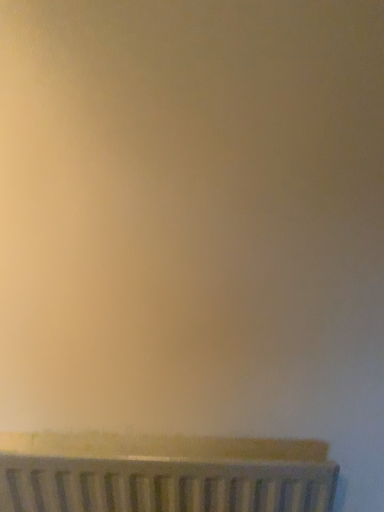
This screenshot has height=512, width=384. Identify the location of white textured radiator at lower center. (163, 474).

The height and width of the screenshot is (512, 384). What do you see at coordinates (163, 474) in the screenshot?
I see `white textured radiator at lower center` at bounding box center [163, 474].

Locate an element on the screen. white textured radiator at lower center is located at coordinates (163, 474).